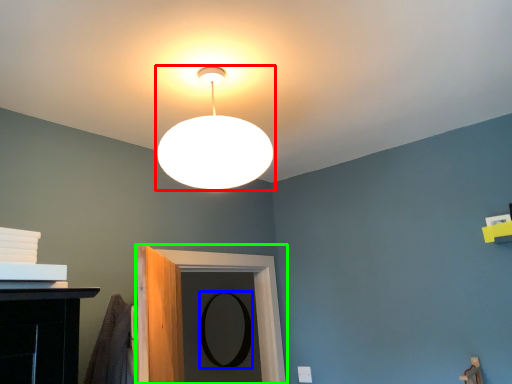
Question: Which object is the farthest from lamp (highlighted by a red box)? Choose among these: mirror (highlighted by a blue box) or door (highlighted by a green box).

Choices:
 (A) mirror
 (B) door

Answer: (A)